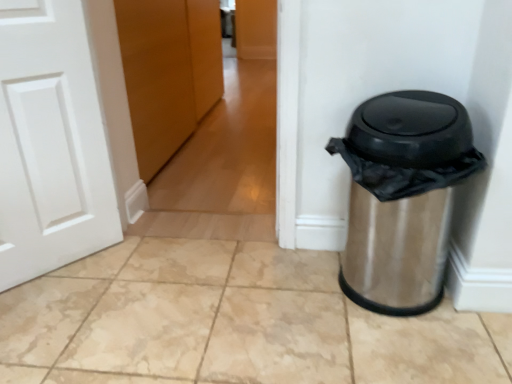
Question: Considering their positions, is stainless steel trash can at right located in front of or behind wooden door at center?

Choices:
 (A) behind
 (B) front

Answer: (B)

Question: From the image's perspective, relative to wooden door at center, is stainless steel trash can at right above or below?

Choices:
 (A) above
 (B) below

Answer: (B)

Question: Is stainless steel trash can at right to the left or to the right of wooden door at center in the image?

Choices:
 (A) left
 (B) right

Answer: (B)

Question: Would you say wooden door at center is to the left or to the right of stainless steel trash can at right in the picture?

Choices:
 (A) right
 (B) left

Answer: (B)

Question: In the image, is wooden door at center positioned in front of or behind stainless steel trash can at right?

Choices:
 (A) behind
 (B) front

Answer: (A)

Question: From a real-world perspective, is wooden door at center physically located above or below stainless steel trash can at right?

Choices:
 (A) below
 (B) above

Answer: (B)

Question: Is wooden door at center wider or thinner than stainless steel trash can at right?

Choices:
 (A) wide
 (B) thin

Answer: (B)